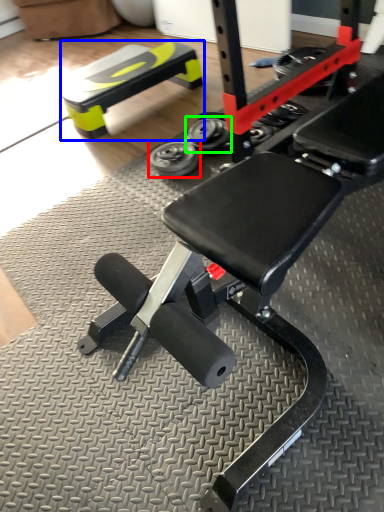
Question: Estimate the real-world distances between objects in this image. Which object is farther from wheel (highlighted by a red box), bench (highlighted by a blue box) or wheel (highlighted by a green box)?

Choices:
 (A) bench
 (B) wheel

Answer: (A)